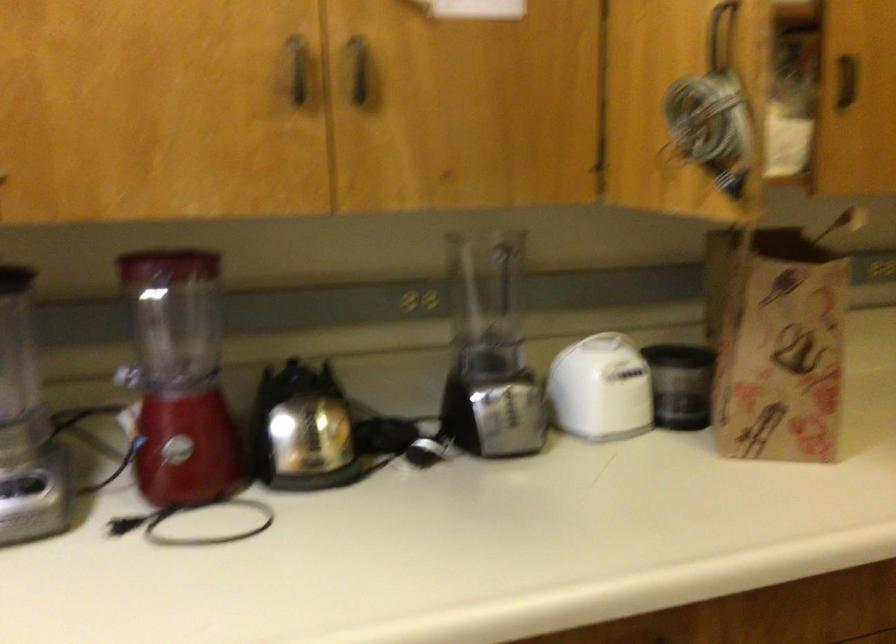
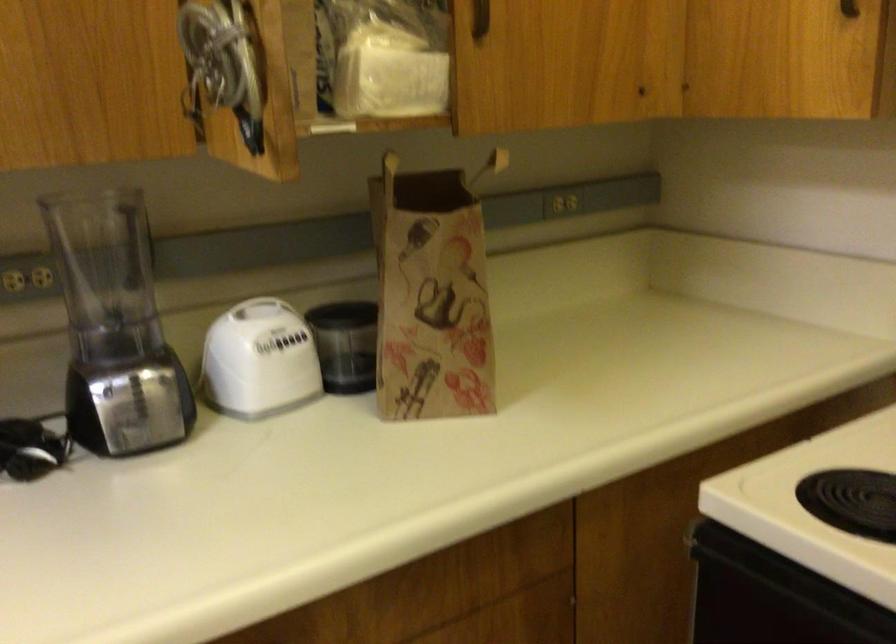
The point at (599, 341) is marked in the first image. Where is the corresponding point in the second image?

(260, 308)